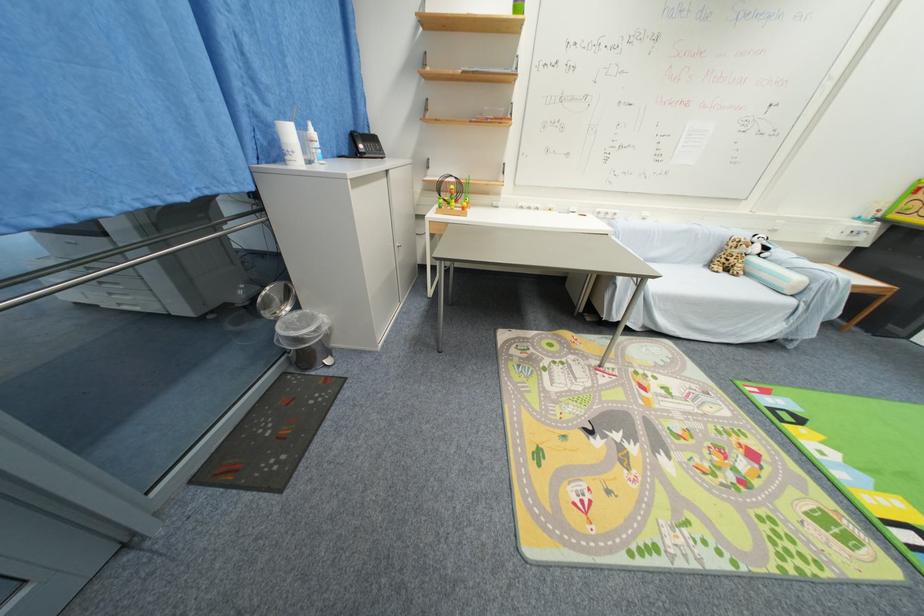
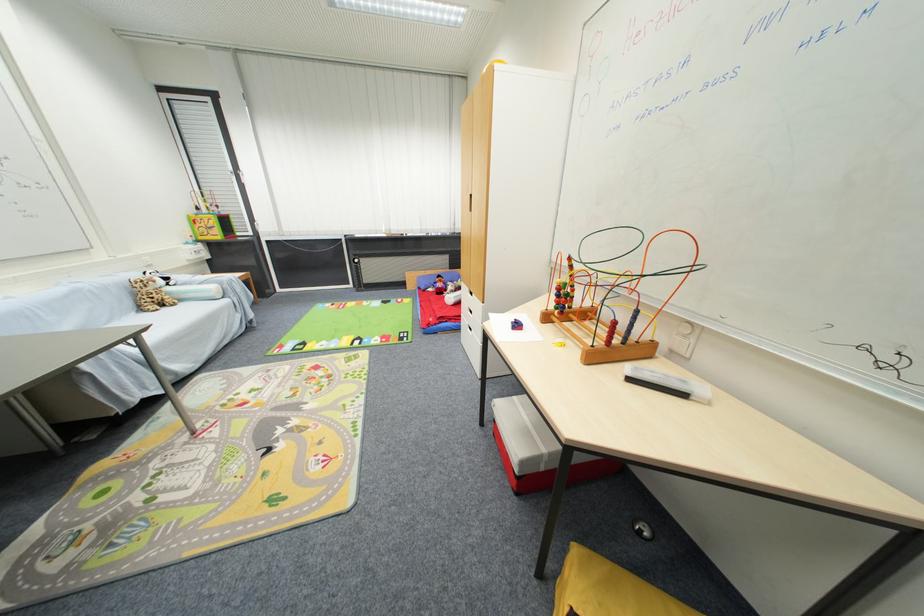
Where in the second image is the point corresponding to point 801,281 from the first image?

(217, 290)